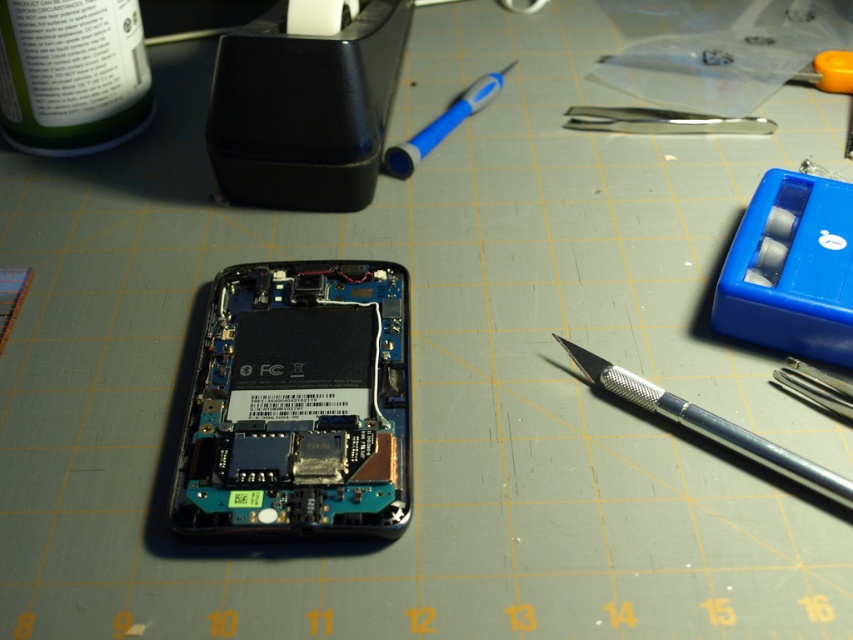
You are an electronics technician working on a repair. You need to locate the green matte bottle at upper left and the silver metallic knife at right. According to the workspace layout, which object is positioned to the left side of the other?

The green matte bottle at upper left is positioned to the left of the silver metallic knife at right.

You are an electronics technician working on the light gray cutting mat. You need to locate the green matte bottle. Where should you look relative to the point marked at coordinates (71, 74)?

The green matte bottle at upper left is located at point (71, 74).

From the picture: You are an electronics technician working on a repair. You need to reach for the green matte bottle at upper left and the blue plastic pen at upper center. Given that your arm can comfortably reach 18 inches, can you comfortably reach both items without moving your chair?

The distance between the green matte bottle at upper left and the blue plastic pen at upper center is 20.20 inches, which exceeds your arm reach of 18 inches. Therefore, you may need to adjust your position to comfortably reach both items.